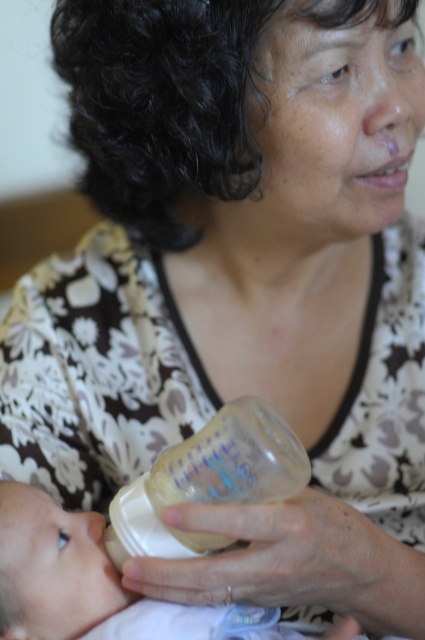
You are a photographer trying to focus on the transparent plastic bottle at center in the image. What are the coordinates of its position?

The transparent plastic bottle at center is located at coordinates (207, 481).

You are a caregiver who needs to choose between two baby bottles for feeding. The transparent plastic bottle at center and the smooth beige baby bottle at lower left are available. Considering their positions, which one is closer to the baby?

The transparent plastic bottle at center is closer to the baby than the smooth beige baby bottle at lower left, so it is the better choice for feeding.

You are a photographer trying to capture a close up of the baby. You need to focus on the baby first before focusing on the transparent plastic bottle at center and the smooth beige baby bottle at lower left. Which bottle should you adjust your focus to next after the baby to capture the one that is closer to the baby?

The smooth beige baby bottle at lower left is to the left of the transparent plastic bottle at center, so after focusing on the baby, you should adjust your focus to the smooth beige baby bottle at lower left since it is closer to the baby.